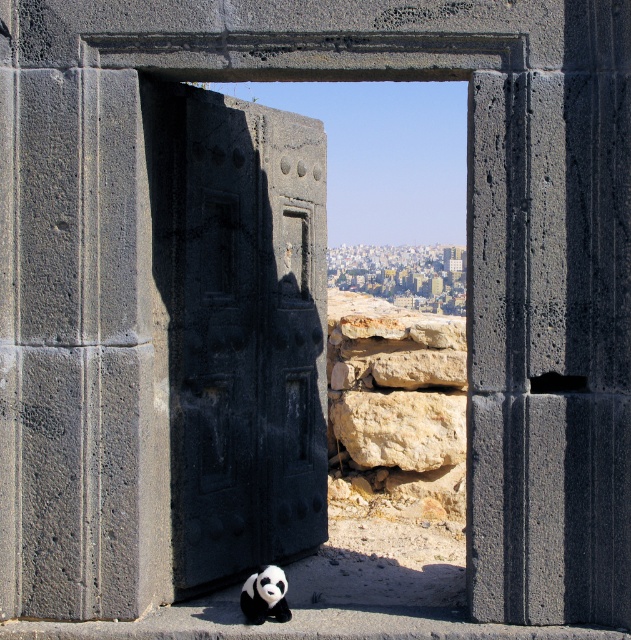
Is dark gray stone door at center further to camera compared to black plush panda at lower center?

Yes, dark gray stone door at center is behind black plush panda at lower center.

Does point (268, 448) come behind point (259, 598)?

Yes.

Where is `dark gray stone door at center`? Image resolution: width=631 pixels, height=640 pixels. dark gray stone door at center is located at coordinates pos(242,332).